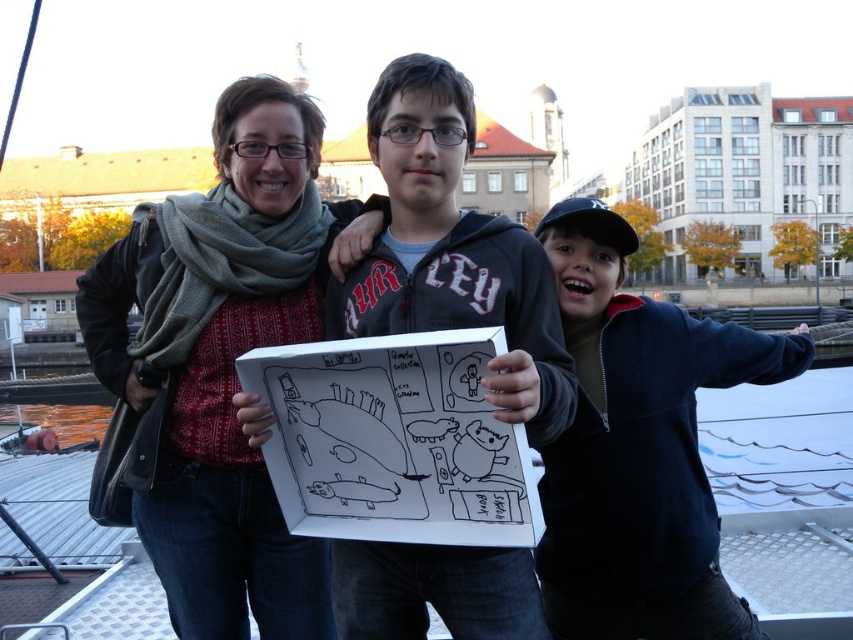
The image size is (853, 640). I want to click on matte gray scarf at center, so click(x=219, y=364).

From the picture: Who is positioned more to the right, matte gray scarf at center or matte black hoodie at center?

matte black hoodie at center

The image size is (853, 640). What do you see at coordinates (219, 364) in the screenshot?
I see `matte gray scarf at center` at bounding box center [219, 364].

What are the coordinates of `matte gray scarf at center` in the screenshot? It's located at (219, 364).

Does point (161, 378) lie in front of point (631, 636)?

No, it is not.

What do you see at coordinates (219, 364) in the screenshot? I see `matte gray scarf at center` at bounding box center [219, 364].

Does point (177, 342) come closer to viewer compared to point (634, 371)?

Yes, point (177, 342) is closer to viewer.

This screenshot has width=853, height=640. In order to click on matte gray scarf at center in this screenshot , I will do `click(219, 364)`.

Consider the image. Can you confirm if dark blue fleece jacket at center is bigger than matte black hoodie at center?

Yes.

Does dark blue fleece jacket at center have a greater height compared to matte black hoodie at center?

Incorrect, dark blue fleece jacket at center's height is not larger of matte black hoodie at center's.

Describe the element at coordinates (637, 448) in the screenshot. I see `dark blue fleece jacket at center` at that location.

You are a GUI agent. You are given a task and a screenshot of the screen. Output one action in this format:
    pyautogui.click(x=<x>, y=<y>)
    Task: Click on the dark blue fleece jacket at center
    
    Given the screenshot: What is the action you would take?
    pyautogui.click(x=637, y=448)